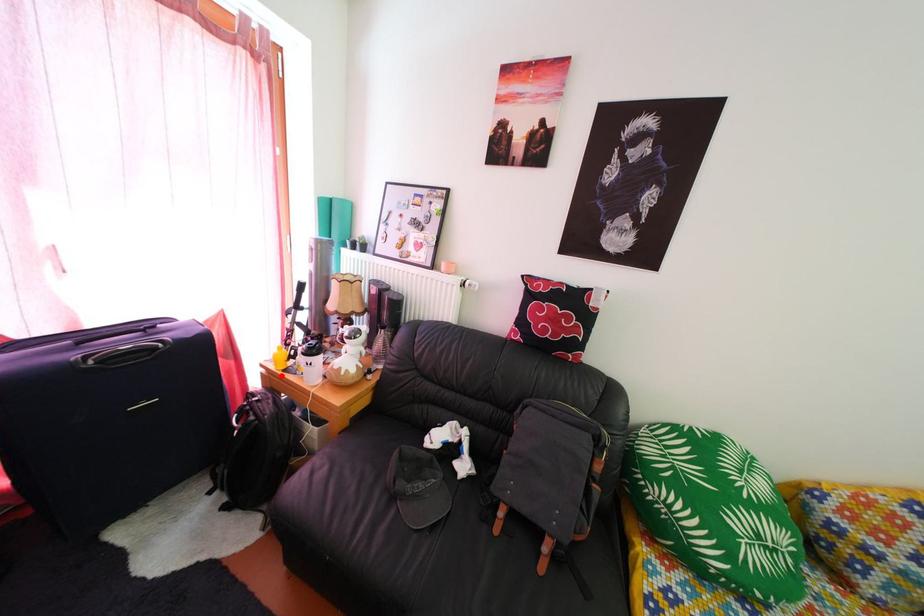
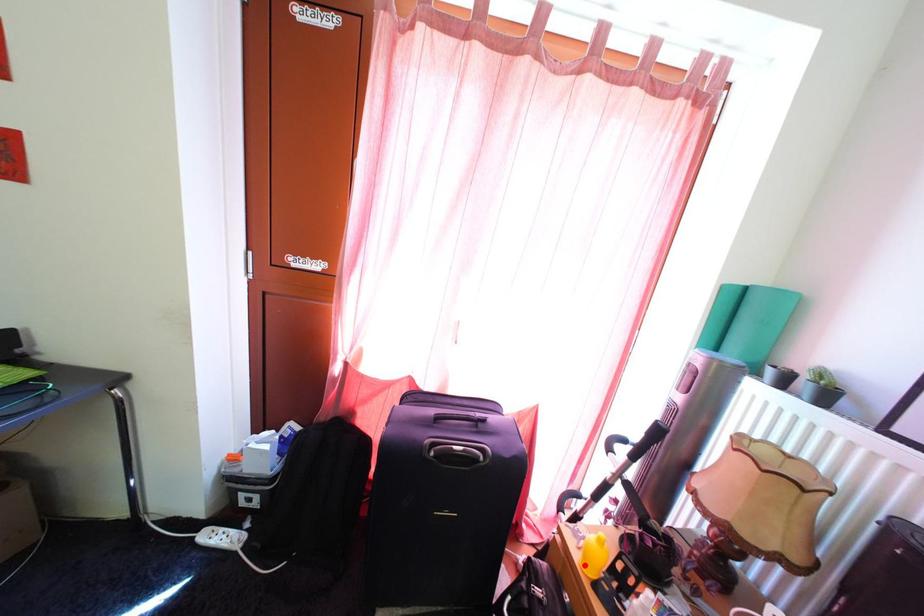
I am providing you with two images of the same scene from different viewpoints. A red point is marked on the first image and another point is marked on the second image. Are the points marked in image1 and image2 representing the same 3D position?

Yes